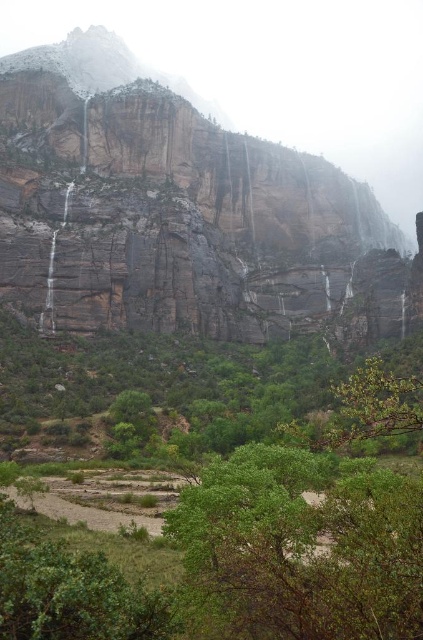
What do you see at coordinates (164, 204) in the screenshot? I see `rustic stone mountain at upper center` at bounding box center [164, 204].

Who is taller, rustic stone mountain at upper center or green leafy tree at lower center?

rustic stone mountain at upper center

Where is `rustic stone mountain at upper center`? rustic stone mountain at upper center is located at coordinates (164, 204).

You are a GUI agent. You are given a task and a screenshot of the screen. Output one action in this format:
    pyautogui.click(x=<x>, y=<y>)
    Task: Click on the rustic stone mountain at upper center
    This screenshot has height=640, width=423.
    Given the screenshot: What is the action you would take?
    pyautogui.click(x=164, y=204)

Between rustic stone mountain at upper center and green leafy tree at lower left, which one appears on the left side from the viewer's perspective?

From the viewer's perspective, rustic stone mountain at upper center appears more on the left side.

Is rustic stone mountain at upper center below green leafy tree at lower left?

No, rustic stone mountain at upper center is not below green leafy tree at lower left.

What do you see at coordinates (164, 204) in the screenshot?
I see `rustic stone mountain at upper center` at bounding box center [164, 204].

Locate an element on the screen. rustic stone mountain at upper center is located at coordinates (164, 204).

Looking at this image, is green leafy tree at lower center wider than green leafy tree at lower left?

Incorrect, green leafy tree at lower center's width does not surpass green leafy tree at lower left's.

Between point (211, 579) and point (310, 385), which one is positioned in front?

Point (211, 579)

The image size is (423, 640). I want to click on green leafy tree at lower center, so click(301, 548).